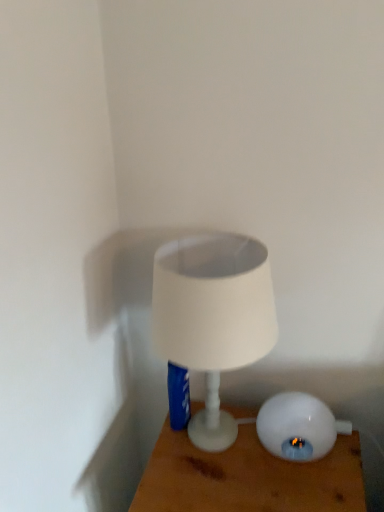
Find the location of `free space that is in between white glossy lamp at lower right, the second lamp from the left, and white matte lampshade at center, acting as the first lamp starting from the left`. free space that is in between white glossy lamp at lower right, the second lamp from the left, and white matte lampshade at center, acting as the first lamp starting from the left is located at coordinates (298, 476).